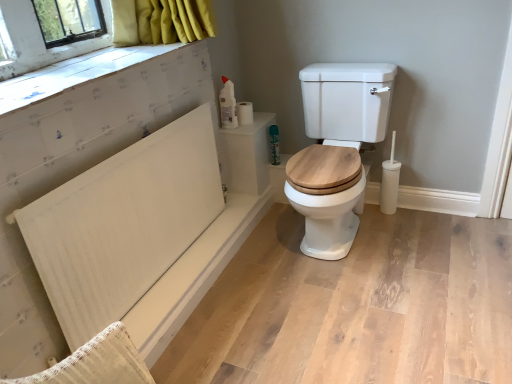
In order to click on free spot above white matte bath at lower left (from a real-world perspective) in this screenshot , I will do `click(224, 249)`.